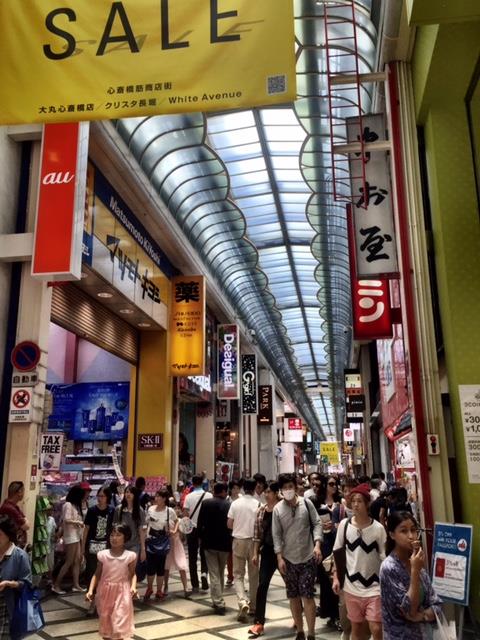
Locate an element on the screen. This screenshot has width=480, height=640. lime green wall is located at coordinates (460, 361).